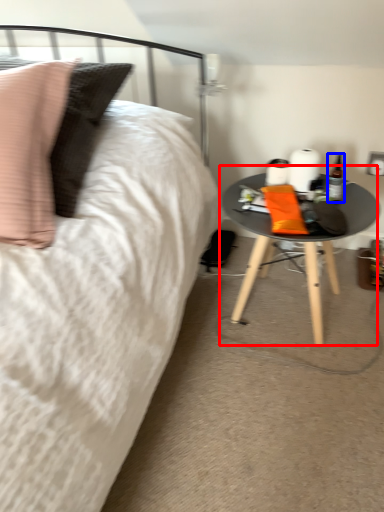
Question: Which point is closer to the camera, table (highlighted by a red box) or bottle (highlighted by a blue box)?

Choices:
 (A) table
 (B) bottle

Answer: (A)